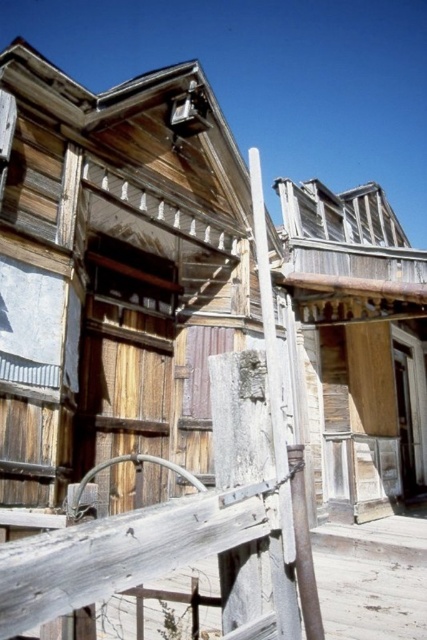
Question: Does weathered wood hut at center appear over smooth gray pole at center?

Choices:
 (A) yes
 (B) no

Answer: (B)

Question: Which point is farther to the camera?

Choices:
 (A) (426, 380)
 (B) (277, 380)

Answer: (A)

Question: Where is weathered wood fence at center located in relation to weathered wood hut at center in the image?

Choices:
 (A) above
 (B) below

Answer: (B)

Question: Observing the image, what is the correct spatial positioning of weathered wood fence at center in reference to weathered wood hut at center?

Choices:
 (A) above
 (B) below

Answer: (B)

Question: Which object is farther from the camera taking this photo?

Choices:
 (A) weathered wood fence at center
 (B) weathered wood hut at center

Answer: (B)

Question: Which of the following is the farthest from the observer?

Choices:
 (A) smooth gray pole at center
 (B) weathered wood hut at center

Answer: (B)